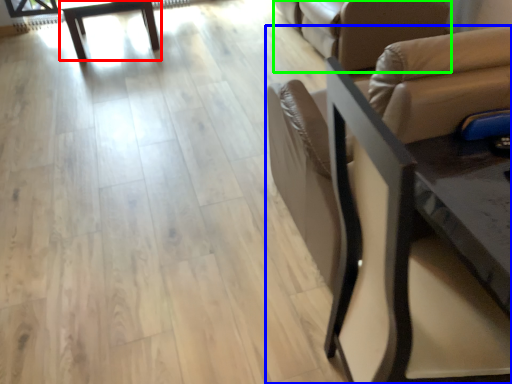
Question: Which object is the closest to the table (highlighted by a red box)? Choose among these: chair (highlighted by a blue box) or futon (highlighted by a green box).

Choices:
 (A) chair
 (B) futon

Answer: (B)